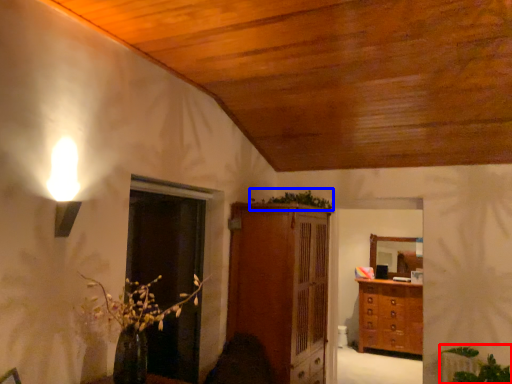
Question: Which object is further to the camera taking this photo, plant (highlighted by a red box) or plant (highlighted by a blue box)?

Choices:
 (A) plant
 (B) plant

Answer: (B)